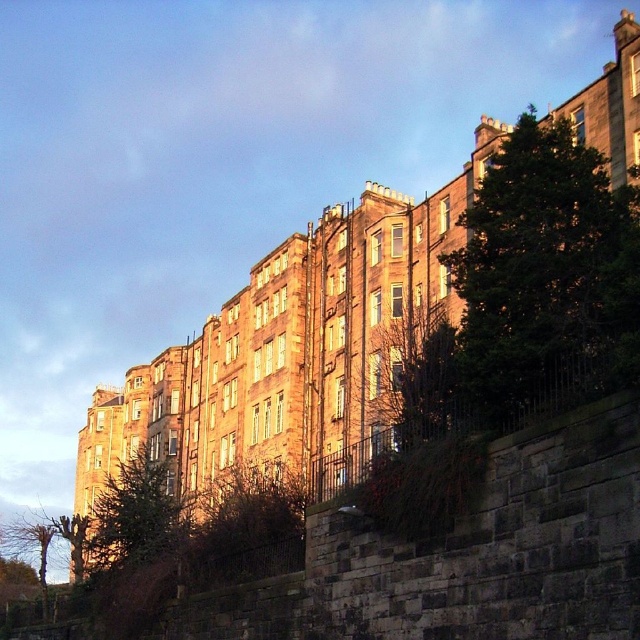
You are a city planner analyzing the layout of this historic district. You need to determine which tree, the dark green leafy tree at right or the green textured tree at center, would be easier to replace if needed. Based on their spatial presence, which one requires more effort due to occupying more space?

The green textured tree at center requires more effort to replace because it occupies more space than the dark green leafy tree at right.

You are standing in front of the buildings and see the dark green leafy tree at right and the green textured tree at center. Which tree is positioned farther to the east?

The dark green leafy tree at right is positioned farther to the east because it is to the right of the green textured tree at center.